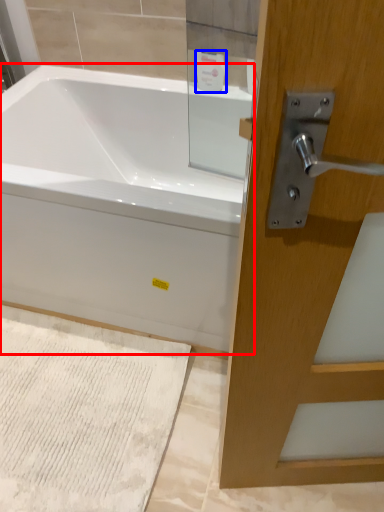
Question: Which object appears closest to the camera in this image, bathtub (highlighted by a red box) or toiletry (highlighted by a blue box)?

Choices:
 (A) bathtub
 (B) toiletry

Answer: (A)